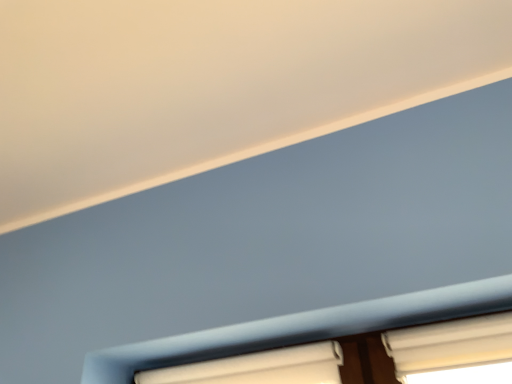
Describe the element at coordinates (258, 368) in the screenshot. I see `white matte window at lower center, which appears as the first window when viewed from the left` at that location.

Identify the location of white matte window at lower center, which appears as the first window when viewed from the left. (258, 368).

This screenshot has width=512, height=384. What do you see at coordinates (454, 351) in the screenshot?
I see `white textured blinds at lower right, the first window positioned from the right` at bounding box center [454, 351].

How much space does white textured blinds at lower right, the first window positioned from the right, occupy vertically?

4.83 inches.

Where is `white textured blinds at lower right, which is the second window from left to right`? This screenshot has height=384, width=512. white textured blinds at lower right, which is the second window from left to right is located at coordinates (454, 351).

This screenshot has height=384, width=512. I want to click on white matte window at lower center, which is the second window from right to left, so click(x=258, y=368).

Consider the image. Which is more to the right, white textured blinds at lower right, which is the second window from left to right, or white matte window at lower center, which is the second window from right to left?

white textured blinds at lower right, which is the second window from left to right.

Relative to white matte window at lower center, which appears as the first window when viewed from the left, is white textured blinds at lower right, the first window positioned from the right, in front or behind?

white textured blinds at lower right, the first window positioned from the right, is positioned closer to the viewer than white matte window at lower center, which appears as the first window when viewed from the left.

Is point (484, 375) behind point (317, 346)?

That is False.

From the image's perspective, who appears lower, white textured blinds at lower right, the first window positioned from the right, or white matte window at lower center, which is the second window from right to left?

From the image's view, white matte window at lower center, which is the second window from right to left, is below.

From a real-world perspective, between white textured blinds at lower right, which is the second window from left to right, and white matte window at lower center, which appears as the first window when viewed from the left, who is vertically lower?

white textured blinds at lower right, which is the second window from left to right.

Does white textured blinds at lower right, which is the second window from left to right, have a lesser width compared to white matte window at lower center, which appears as the first window when viewed from the left?

No.

Considering the relative sizes of white textured blinds at lower right, the first window positioned from the right, and white matte window at lower center, which is the second window from right to left, in the image provided, is white textured blinds at lower right, the first window positioned from the right, taller than white matte window at lower center, which is the second window from right to left,?

Yes.

Which of these two, white textured blinds at lower right, which is the second window from left to right, or white matte window at lower center, which appears as the first window when viewed from the left, is bigger?

Bigger between the two is white matte window at lower center, which appears as the first window when viewed from the left.

Could white matte window at lower center, which is the second window from right to left, be considered to be inside white textured blinds at lower right, which is the second window from left to right?

No, white textured blinds at lower right, which is the second window from left to right, does not contain white matte window at lower center, which is the second window from right to left.

Are white textured blinds at lower right, which is the second window from left to right, and white matte window at lower center, which is the second window from right to left, beside each other?

No, white textured blinds at lower right, which is the second window from left to right, is not making contact with white matte window at lower center, which is the second window from right to left.

Could you tell me if white textured blinds at lower right, the first window positioned from the right, is turned towards white matte window at lower center, which is the second window from right to left?

No, white textured blinds at lower right, the first window positioned from the right, is not turned towards white matte window at lower center, which is the second window from right to left.

How different are the orientations of white textured blinds at lower right, the first window positioned from the right, and white matte window at lower center, which is the second window from right to left, in degrees?

The angle between the facing direction of white textured blinds at lower right, the first window positioned from the right, and the facing direction of white matte window at lower center, which is the second window from right to left, is 0.00226 degrees.

The height and width of the screenshot is (384, 512). Find the location of `window that is above the white matte window at lower center, which is the second window from right to left (from the image's perspective)`. window that is above the white matte window at lower center, which is the second window from right to left (from the image's perspective) is located at coordinates (454, 351).

Does white matte window at lower center, which appears as the first window when viewed from the left, appear on the right side of white textured blinds at lower right, which is the second window from left to right?

Incorrect, white matte window at lower center, which appears as the first window when viewed from the left, is not on the right side of white textured blinds at lower right, which is the second window from left to right.

Considering their positions, is white matte window at lower center, which appears as the first window when viewed from the left, located in front of or behind white textured blinds at lower right, the first window positioned from the right?

Clearly, white matte window at lower center, which appears as the first window when viewed from the left, is behind white textured blinds at lower right, the first window positioned from the right.

Is point (286, 354) more distant than point (403, 369)?

That is True.

From the image's perspective, between white matte window at lower center, which is the second window from right to left, and white textured blinds at lower right, the first window positioned from the right, which one is located above?

white textured blinds at lower right, the first window positioned from the right, appears higher in the image.

From a real-world perspective, relative to white textured blinds at lower right, which is the second window from left to right, is white matte window at lower center, which appears as the first window when viewed from the left, vertically above or below?

Clearly, from a real-world perspective, white matte window at lower center, which appears as the first window when viewed from the left, is above white textured blinds at lower right, which is the second window from left to right.

Considering the relative sizes of white matte window at lower center, which appears as the first window when viewed from the left, and white textured blinds at lower right, the first window positioned from the right, in the image provided, is white matte window at lower center, which appears as the first window when viewed from the left, thinner than white textured blinds at lower right, the first window positioned from the right,?

Yes.

Considering the relative sizes of white matte window at lower center, which is the second window from right to left, and white textured blinds at lower right, which is the second window from left to right, in the image provided, is white matte window at lower center, which is the second window from right to left, taller than white textured blinds at lower right, which is the second window from left to right,?

No, white matte window at lower center, which is the second window from right to left, is not taller than white textured blinds at lower right, which is the second window from left to right.

Is white matte window at lower center, which appears as the first window when viewed from the left, bigger than white textured blinds at lower right, which is the second window from left to right?

Yes.

Would you say white textured blinds at lower right, the first window positioned from the right, is part of white matte window at lower center, which appears as the first window when viewed from the left,'s contents?

That's incorrect, white textured blinds at lower right, the first window positioned from the right, is not inside white matte window at lower center, which appears as the first window when viewed from the left.

Consider the image. Can you see white matte window at lower center, which is the second window from right to left, touching white textured blinds at lower right, the first window positioned from the right?

No, white matte window at lower center, which is the second window from right to left, is not next to white textured blinds at lower right, the first window positioned from the right.

Is white textured blinds at lower right, the first window positioned from the right, at the back of white matte window at lower center, which appears as the first window when viewed from the left?

No, white textured blinds at lower right, the first window positioned from the right, is not at the back of white matte window at lower center, which appears as the first window when viewed from the left.

How different are the orientations of white matte window at lower center, which is the second window from right to left, and white textured blinds at lower right, which is the second window from left to right, in degrees?

0.00226 degrees separate the facing orientations of white matte window at lower center, which is the second window from right to left, and white textured blinds at lower right, which is the second window from left to right.

How much distance is there between white matte window at lower center, which appears as the first window when viewed from the left, and white textured blinds at lower right, the first window positioned from the right?

white matte window at lower center, which appears as the first window when viewed from the left, is 29.83 centimeters away from white textured blinds at lower right, the first window positioned from the right.

Find the location of a particular element. The image size is (512, 384). window in front of the white matte window at lower center, which is the second window from right to left is located at coordinates (454, 351).

Where is `window below the white textured blinds at lower right, which is the second window from left to right (from the image's perspective)`? window below the white textured blinds at lower right, which is the second window from left to right (from the image's perspective) is located at coordinates (258, 368).

The height and width of the screenshot is (384, 512). I want to click on window that appears in front of the white matte window at lower center, which is the second window from right to left, so click(x=454, y=351).